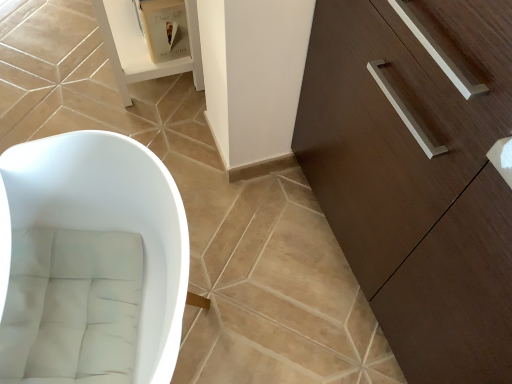
I want to click on white leather bathtub at lower left, so click(112, 220).

The height and width of the screenshot is (384, 512). What do you see at coordinates (112, 220) in the screenshot?
I see `white leather bathtub at lower left` at bounding box center [112, 220].

Where is `white leather bathtub at lower left`? white leather bathtub at lower left is located at coordinates (112, 220).